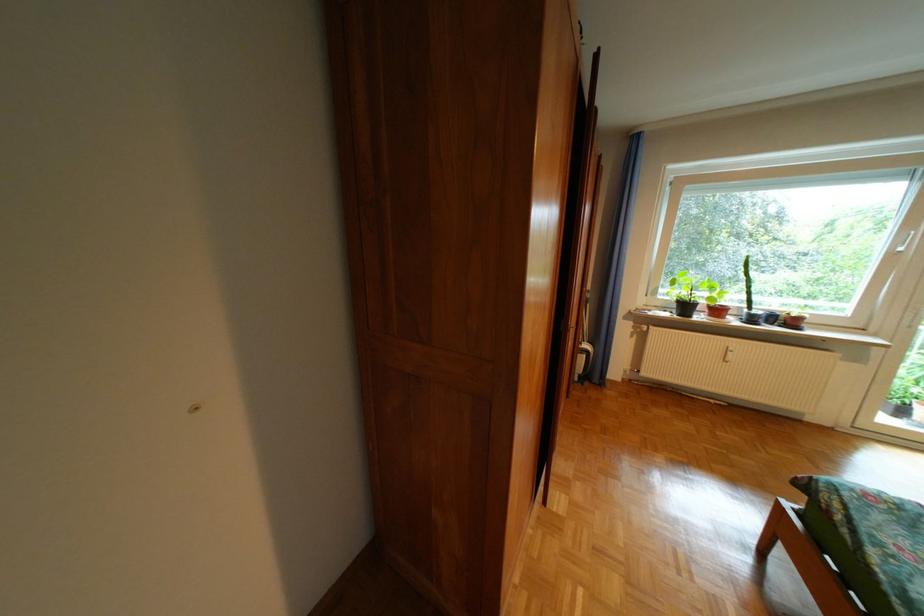
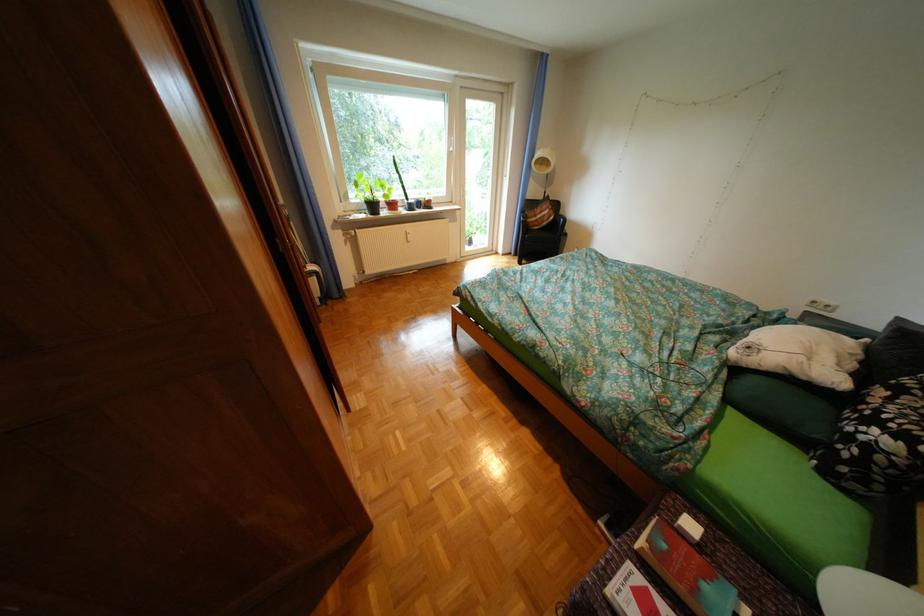
The point at (699, 307) is marked in the first image. Where is the corresponding point in the second image?

(387, 207)